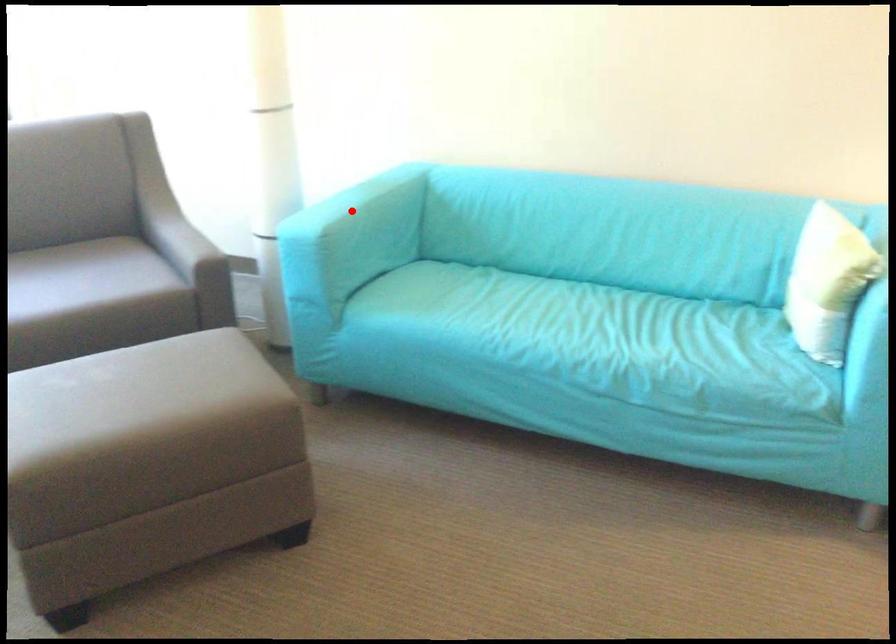
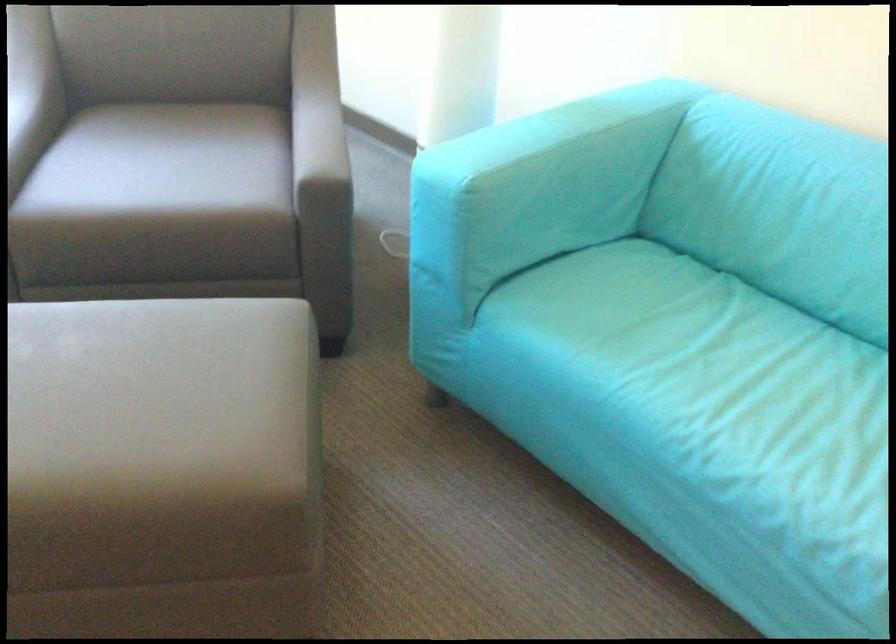
Question: I am providing you with two images of the same scene from different viewpoints. In image1, a red point is highlighted. Considering the same 3D point in image2, which of the following is correct?

Choices:
 (A) It is closer
 (B) It is farther

Answer: (A)